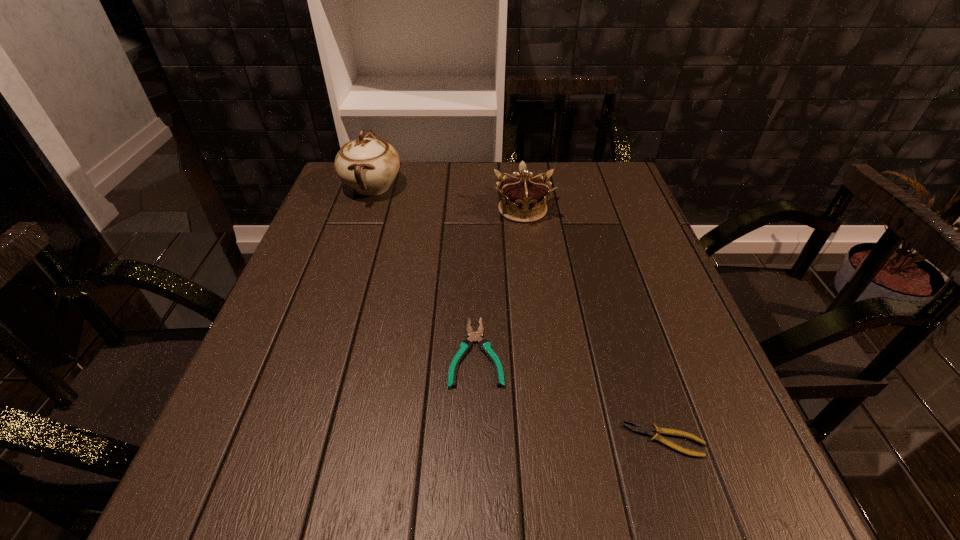
The height and width of the screenshot is (540, 960). I want to click on free region at the near right corner of the desktop, so click(660, 475).

Identify the location of unoccupied area between the second nearest object and the tallest object. The image size is (960, 540). (424, 270).

Find the location of a particular element. The height and width of the screenshot is (540, 960). free space between the tallest object and the left pliers is located at coordinates (424, 270).

You are a GUI agent. You are given a task and a screenshot of the screen. Output one action in this format:
    pyautogui.click(x=<x>, y=<y>)
    Task: Click on the vacant area that lies between the second tallest object and the nearer pliers
    Image resolution: width=960 pixels, height=540 pixels.
    Given the screenshot: What is the action you would take?
    pyautogui.click(x=593, y=325)

What are the coordinates of `free spot between the crown and the tallest object` in the screenshot? It's located at (x=447, y=198).

At what (x,y) coordinates should I click in order to perform the action: click on blank region between the chinaware and the left pliers. Please return your answer as a coordinate pair (x, y). The width and height of the screenshot is (960, 540). Looking at the image, I should click on (424, 270).

I want to click on free spot between the right pliers and the crown, so click(x=593, y=325).

Where is `free space between the left pliers and the tallest object`? free space between the left pliers and the tallest object is located at coordinates (424, 270).

Where is `empty space between the second tallest object and the left pliers`? This screenshot has height=540, width=960. empty space between the second tallest object and the left pliers is located at coordinates (499, 281).

Identify the location of free spot between the leftmost object and the crown. (447, 198).